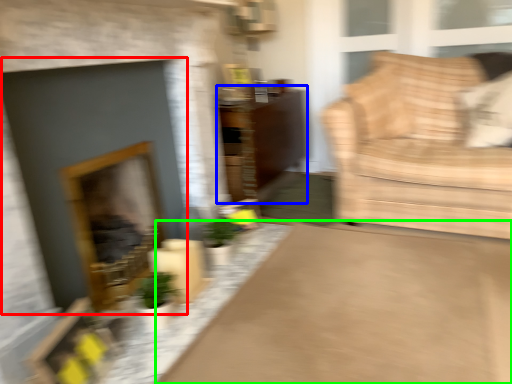
Question: Which object is the closest to the fireplace (highlighted by a red box)? Choose among these: dresser (highlighted by a blue box) or plain (highlighted by a green box).

Choices:
 (A) dresser
 (B) plain

Answer: (B)